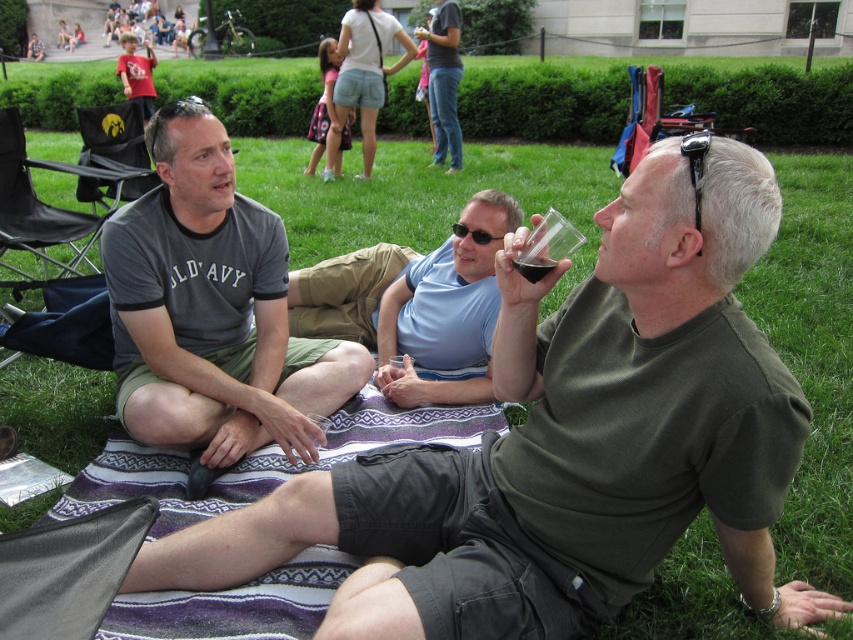
Question: Does black rubber sunglasses at upper right lie behind dark glass at center?

Choices:
 (A) yes
 (B) no

Answer: (B)

Question: Does light blue fabric at center appear over dark glass at center?

Choices:
 (A) yes
 (B) no

Answer: (A)

Question: Among these points, which one is farthest from the camera?

Choices:
 (A) (699, 227)
 (B) (540, 275)
 (C) (157, 120)

Answer: (C)

Question: Considering the real-world distances, which object is farthest from the black rubber sunglasses at upper right?

Choices:
 (A) matte green t-shirt at center
 (B) gray cotton t-shirt at left

Answer: (B)

Question: Is gray cotton t-shirt at left further to the viewer compared to light blue fabric at center?

Choices:
 (A) yes
 (B) no

Answer: (B)

Question: Based on their relative distances, which object is farther from the matte green t-shirt at center?

Choices:
 (A) gray cotton t-shirt at left
 (B) black rubber sunglasses at upper right

Answer: (A)